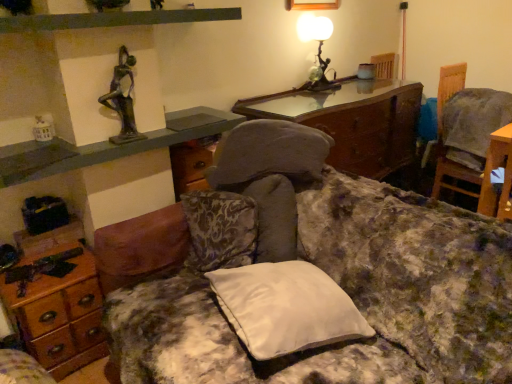
Question: Considering the positions of point click(76, 18) and point click(471, 132), is point click(76, 18) closer or farther from the camera than point click(471, 132)?

Choices:
 (A) closer
 (B) farther

Answer: (A)

Question: Considering the positions of black matte shelf at upper center and wooden chair at right in the image, is black matte shelf at upper center bigger or smaller than wooden chair at right?

Choices:
 (A) small
 (B) big

Answer: (A)

Question: Estimate the real-world distances between objects in this image. Which object is farther from the wooden desk at upper center?

Choices:
 (A) wooden desk at lower left
 (B) white satin pillow at center
 (C) fluffy fabric couch at center
 (D) matte glass table lamp at upper right
 (E) black matte shelf at upper center

Answer: (A)

Question: Based on their relative distances, which object is farther from the matte glass table lamp at upper right?

Choices:
 (A) white satin pillow at center
 (B) fluffy fabric couch at center
 (C) black matte shelf at upper center
 (D) wooden desk at lower left
 (E) wooden chair at right

Answer: (D)